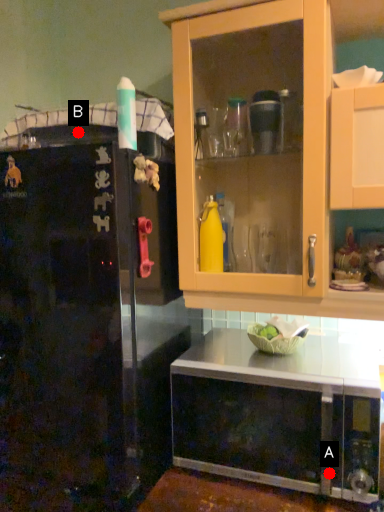
Question: Two points are circled on the image, labeled by A and B beside each circle. Which point is closer to the camera taking this photo?

Choices:
 (A) A is closer
 (B) B is closer

Answer: (A)